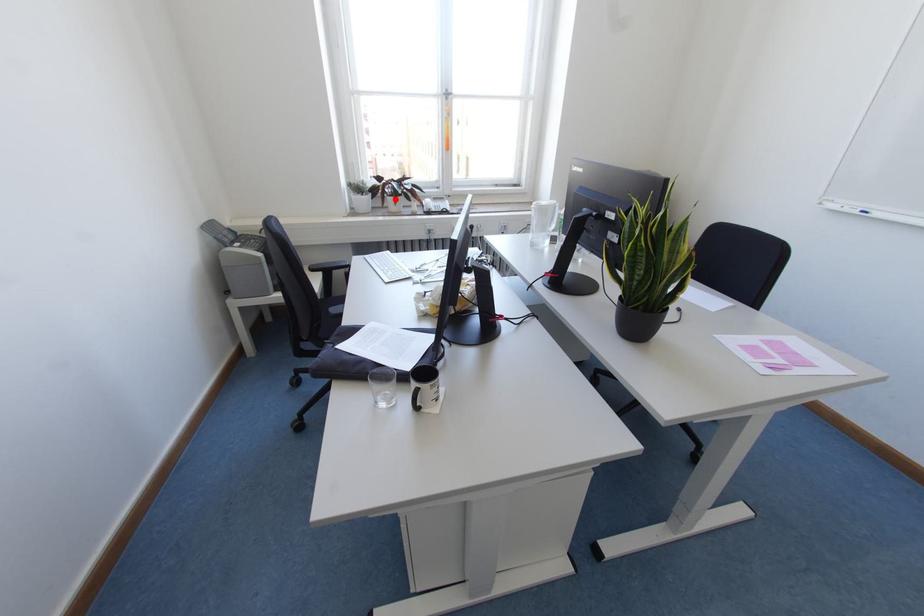
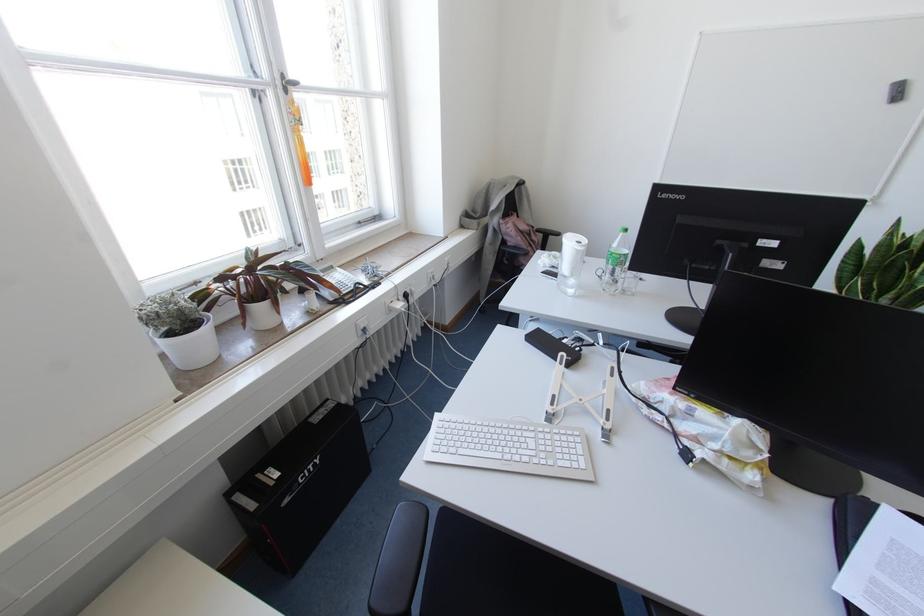
Where in the second image is the point corresponding to the highlighted location from the first image?

(274, 302)